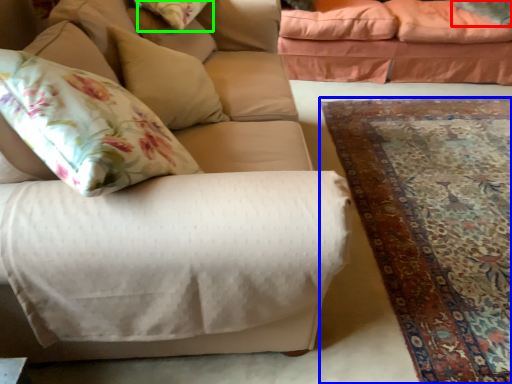
Question: Which is farther away from pillow (highlighted by a red box)? mat (highlighted by a blue box) or pillow (highlighted by a green box)?

Choices:
 (A) mat
 (B) pillow

Answer: (B)